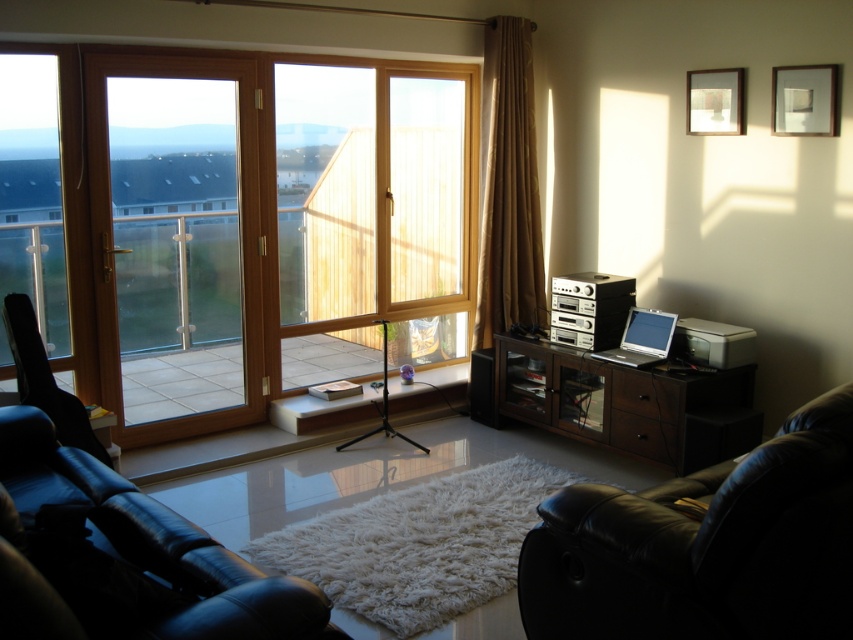
Can you confirm if black leather armchair at lower left is taller than dark wood cabinet at center right?

No, black leather armchair at lower left is not taller than dark wood cabinet at center right.

From the picture: Can you confirm if black leather armchair at lower left is bigger than dark wood cabinet at center right?

Indeed, black leather armchair at lower left has a larger size compared to dark wood cabinet at center right.

Measure the distance between point (83, 595) and camera.

Point (83, 595) is 1.95 meters from camera.

At what (x,y) coordinates should I click in order to perform the action: click on black leather armchair at lower left. Please return your answer as a coordinate pair (x, y). Looking at the image, I should click on (126, 556).

Is the position of black leather armchair at lower right more distant than that of brown fabric curtain at right?

No.

Does black leather armchair at lower right appear over brown fabric curtain at right?

No.

The image size is (853, 640). Identify the location of black leather armchair at lower right. (705, 545).

Which of these two, transparent glass door at left or silver metallic laptop at right, stands shorter?

silver metallic laptop at right

Can you confirm if transparent glass door at left is shorter than silver metallic laptop at right?

In fact, transparent glass door at left may be taller than silver metallic laptop at right.

Is point (189, 228) more distant than point (628, 332)?

Yes, point (189, 228) is behind point (628, 332).

I want to click on transparent glass door at left, so click(175, 243).